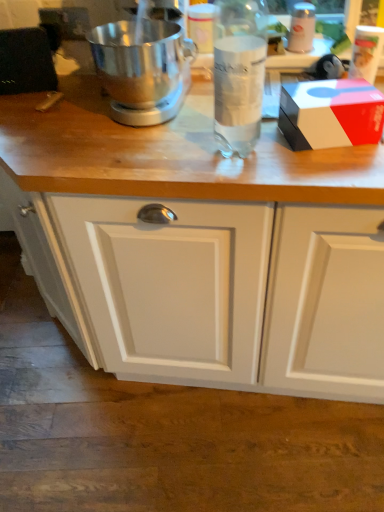
Question: Does white glossy bottle at upper right, which ranks as the second bottle in left-to-right order, appear on the right side of polished silver mixer at center?

Choices:
 (A) no
 (B) yes

Answer: (B)

Question: Can you confirm if white glossy bottle at upper right, marked as the 2th bottle in a bottom-to-top arrangement, is taller than polished silver mixer at center?

Choices:
 (A) yes
 (B) no

Answer: (B)

Question: Is white glossy bottle at upper right, acting as the 2th bottle starting from the front, in front of polished silver mixer at center?

Choices:
 (A) yes
 (B) no

Answer: (B)

Question: Does white glossy bottle at upper right, marked as the first bottle in a right-to-left arrangement, appear on the left side of polished silver mixer at center?

Choices:
 (A) yes
 (B) no

Answer: (B)

Question: Can you confirm if white glossy bottle at upper right, the 1th bottle in the top-to-bottom sequence, is wider than polished silver mixer at center?

Choices:
 (A) no
 (B) yes

Answer: (A)

Question: In terms of size, does white matte cabinet at lower center appear bigger or smaller than polished silver mixer at center?

Choices:
 (A) small
 (B) big

Answer: (B)

Question: Is white matte cabinet at lower center in front of or behind polished silver mixer at center in the image?

Choices:
 (A) behind
 (B) front

Answer: (A)

Question: From a real-world perspective, is white matte cabinet at lower center positioned above or below polished silver mixer at center?

Choices:
 (A) above
 (B) below

Answer: (B)

Question: Looking at their shapes, would you say white matte cabinet at lower center is wider or thinner than polished silver mixer at center?

Choices:
 (A) wide
 (B) thin

Answer: (A)

Question: Relative to clear glass bottle at center, placed as the first bottle when sorted from left to right, is polished silver mixer at center in front or behind?

Choices:
 (A) front
 (B) behind

Answer: (B)

Question: From the image's perspective, is polished silver mixer at center positioned above or below clear glass bottle at center, the second bottle positioned from the top?

Choices:
 (A) below
 (B) above

Answer: (B)

Question: Considering the positions of polished silver mixer at center and clear glass bottle at center, which is the 1th bottle in bottom-to-top order, in the image, is polished silver mixer at center wider or thinner than clear glass bottle at center, which is the 1th bottle in bottom-to-top order,?

Choices:
 (A) thin
 (B) wide

Answer: (B)

Question: In the image, is polished silver mixer at center on the left side or the right side of clear glass bottle at center, which is the 1th bottle in bottom-to-top order?

Choices:
 (A) left
 (B) right

Answer: (A)

Question: In terms of width, does polished silver mixer at center look wider or thinner when compared to white glossy bottle at upper right, marked as the 2th bottle in a bottom-to-top arrangement?

Choices:
 (A) wide
 (B) thin

Answer: (A)

Question: Based on their sizes in the image, would you say polished silver mixer at center is bigger or smaller than white glossy bottle at upper right, which is counted as the 1th bottle, starting from the back?

Choices:
 (A) big
 (B) small

Answer: (A)